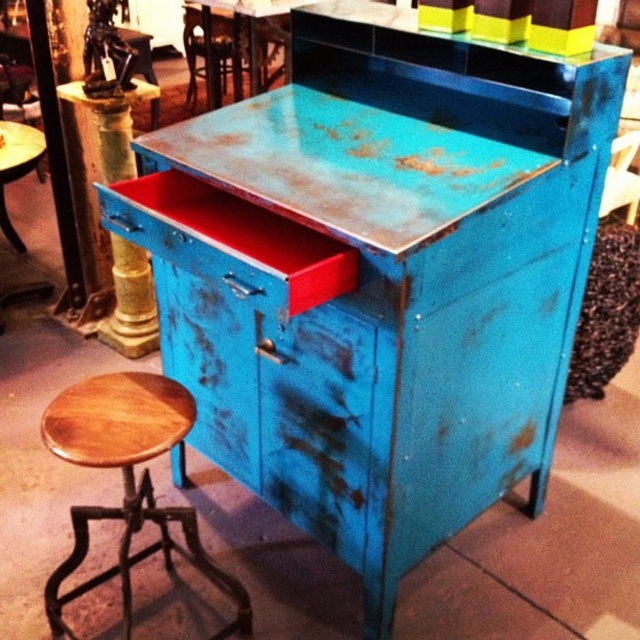
Question: Does wooden chair at center appear under metallic blue chair at center?

Choices:
 (A) no
 (B) yes

Answer: (A)

Question: Based on their relative distances, which object is farther from the metallic blue chair at center?

Choices:
 (A) wooden seat stool at lower left
 (B) wooden chair at center

Answer: (B)

Question: Does wooden seat stool at lower left have a greater width compared to wooden chair at center?

Choices:
 (A) yes
 (B) no

Answer: (A)

Question: Which object is the farthest from the wooden seat stool at lower left?

Choices:
 (A) wooden chair at center
 (B) metallic blue chair at center

Answer: (A)

Question: Does wooden seat stool at lower left have a smaller size compared to metallic blue chair at center?

Choices:
 (A) no
 (B) yes

Answer: (A)

Question: Which object is farther from the camera taking this photo?

Choices:
 (A) metallic blue chair at center
 (B) wooden chair at center
 (C) wooden seat stool at lower left

Answer: (B)